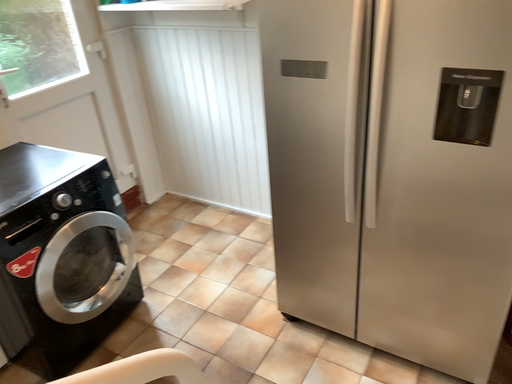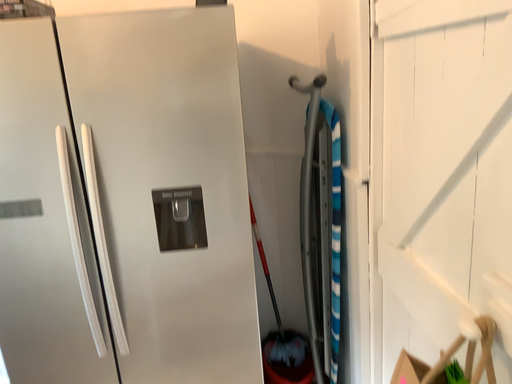
Question: Which way did the camera rotate in the video?

Choices:
 (A) rotated downward
 (B) rotated upward

Answer: (B)